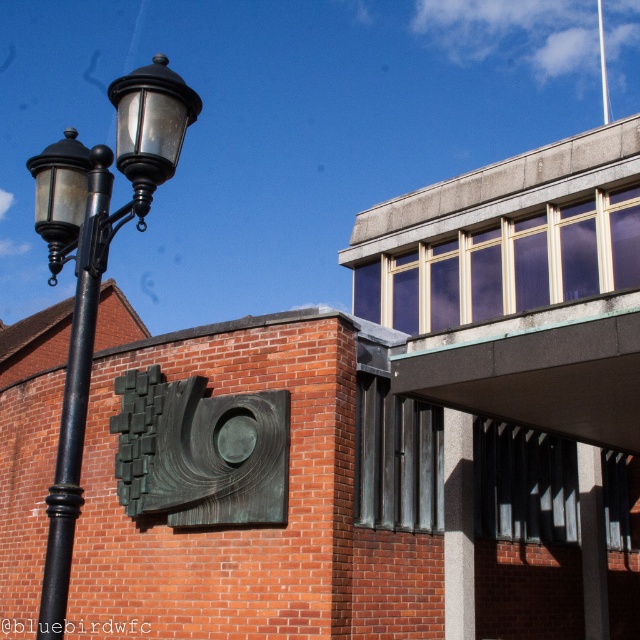
The height and width of the screenshot is (640, 640). I want to click on black metal streetlight at left, so click(97, 266).

Is black metal streetlight at left positioned at the back of black metal pole at left?

Yes, it is.

Which is in front, point (77, 307) or point (99, 214)?

Point (77, 307) is more forward.

I want to click on black metal streetlight at left, so click(x=97, y=266).